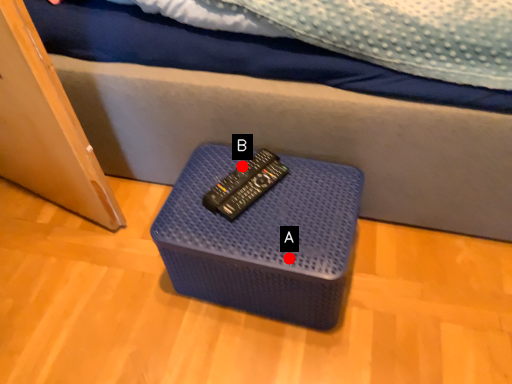
Question: Two points are circled on the image, labeled by A and B beside each circle. Which of the following is the closest to the observer?

Choices:
 (A) A is closer
 (B) B is closer

Answer: (A)